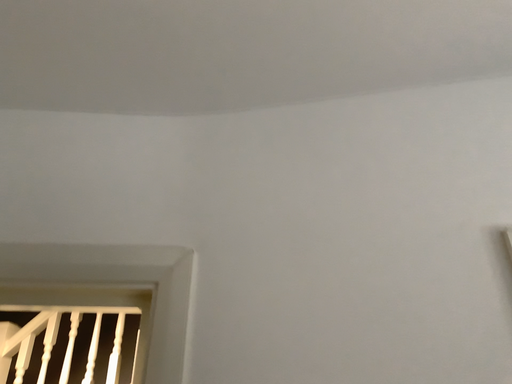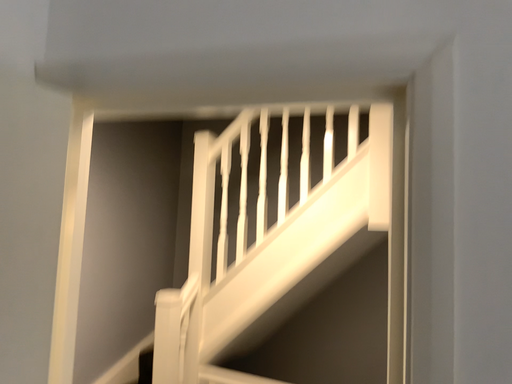
Question: How did the camera likely rotate when shooting the video?

Choices:
 (A) rotated left
 (B) rotated right

Answer: (A)